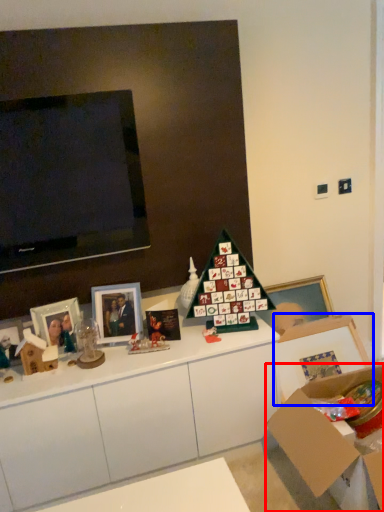
Question: Which of the following is the closest to the observer, cardboard box (highlighted by a red box) or picture frame (highlighted by a blue box)?

Choices:
 (A) cardboard box
 (B) picture frame

Answer: (A)